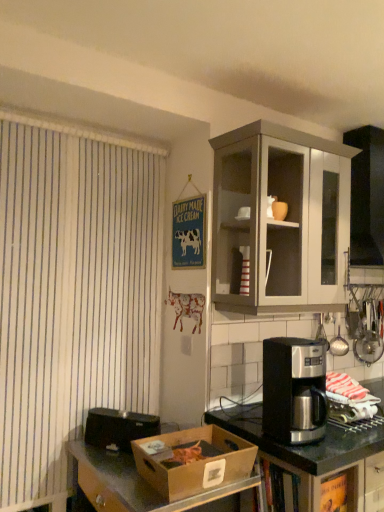
Question: Does metallic silver coffee maker at right have a larger size compared to matte ceramic cup at upper center?

Choices:
 (A) no
 (B) yes

Answer: (B)

Question: Is metallic silver coffee maker at right surrounding matte ceramic cup at upper center?

Choices:
 (A) yes
 (B) no

Answer: (B)

Question: Is metallic silver coffee maker at right smaller than matte ceramic cup at upper center?

Choices:
 (A) yes
 (B) no

Answer: (B)

Question: Is metallic silver coffee maker at right to the left of matte ceramic cup at upper center from the viewer's perspective?

Choices:
 (A) yes
 (B) no

Answer: (B)

Question: Considering the relative positions of metallic silver coffee maker at right and matte ceramic cup at upper center in the image provided, is metallic silver coffee maker at right to the right of matte ceramic cup at upper center from the viewer's perspective?

Choices:
 (A) no
 (B) yes

Answer: (B)

Question: Considering the relative sizes of metallic silver coffee maker at right and matte ceramic cup at upper center in the image provided, is metallic silver coffee maker at right thinner than matte ceramic cup at upper center?

Choices:
 (A) yes
 (B) no

Answer: (B)

Question: Is matte ceramic cup at upper center bigger than metallic silver cooking utensils at right, which is counted as the second appliance, starting from the left?

Choices:
 (A) no
 (B) yes

Answer: (A)

Question: Considering the relative positions of matte ceramic cup at upper center and metallic silver cooking utensils at right, the first appliance positioned from the back, in the image provided, is matte ceramic cup at upper center to the left of metallic silver cooking utensils at right, the first appliance positioned from the back, from the viewer's perspective?

Choices:
 (A) no
 (B) yes

Answer: (B)

Question: Can you confirm if matte ceramic cup at upper center is smaller than metallic silver cooking utensils at right, the 1th appliance in the top-to-bottom sequence?

Choices:
 (A) yes
 (B) no

Answer: (A)

Question: Is matte ceramic cup at upper center closer to the viewer compared to metallic silver cooking utensils at right, the 1th appliance in the top-to-bottom sequence?

Choices:
 (A) yes
 (B) no

Answer: (A)

Question: Can we say matte ceramic cup at upper center lies outside metallic silver cooking utensils at right, the first appliance positioned from the back?

Choices:
 (A) no
 (B) yes

Answer: (B)

Question: Can you confirm if matte ceramic cup at upper center is taller than metallic silver cooking utensils at right, acting as the 2th appliance starting from the bottom?

Choices:
 (A) no
 (B) yes

Answer: (A)

Question: Considering the relative sizes of matte ceramic cup at upper center and brown cardboard box at lower left in the image provided, is matte ceramic cup at upper center smaller than brown cardboard box at lower left?

Choices:
 (A) yes
 (B) no

Answer: (A)